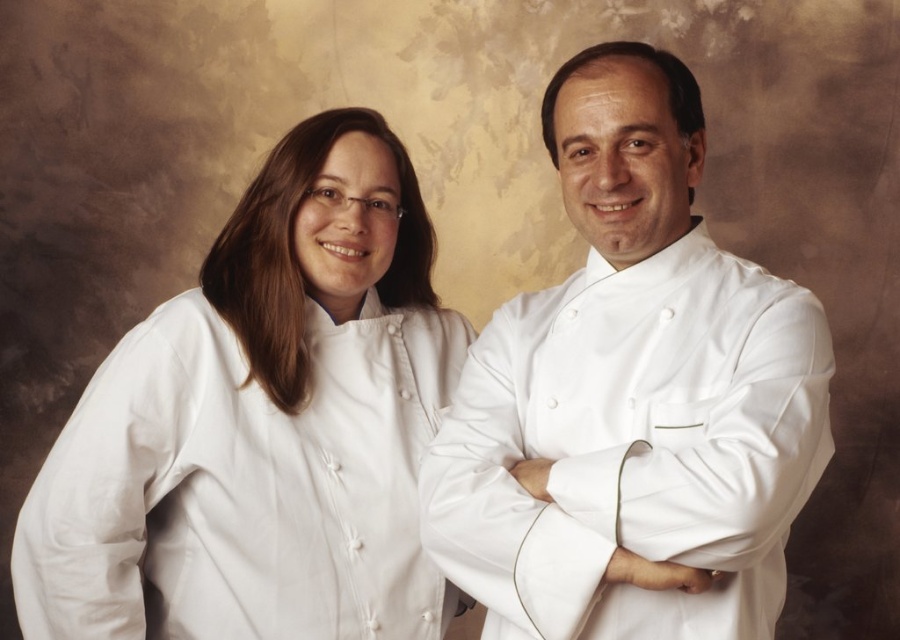
Can you confirm if white smooth chef coat at left is shorter than white satin chef coat at right?

Incorrect, white smooth chef coat at left's height does not fall short of white satin chef coat at right's.

Does white smooth chef coat at left lie in front of white satin chef coat at right?

No, white smooth chef coat at left is behind white satin chef coat at right.

Is point (292, 250) farther from viewer compared to point (614, 376)?

That is True.

In order to click on white smooth chef coat at left in this screenshot , I will do `click(262, 424)`.

Who is shorter, white smooth chef coat at left or white smooth chef coat at center?

With less height is white smooth chef coat at left.

Is white smooth chef coat at left below white smooth chef coat at center?

Indeed, white smooth chef coat at left is positioned under white smooth chef coat at center.

Does point (147, 579) lie behind point (426, 490)?

Yes, it is.

You are a GUI agent. You are given a task and a screenshot of the screen. Output one action in this format:
    pyautogui.click(x=<x>, y=<y>)
    Task: Click on the white smooth chef coat at left
    The width and height of the screenshot is (900, 640).
    Given the screenshot: What is the action you would take?
    pyautogui.click(x=262, y=424)

Can you confirm if white smooth chef coat at center is taller than white satin chef coat at right?

Correct, white smooth chef coat at center is much taller as white satin chef coat at right.

Is point (522, 474) in front of point (495, 588)?

That is False.

Find the location of a particular element. The height and width of the screenshot is (640, 900). white smooth chef coat at center is located at coordinates (632, 396).